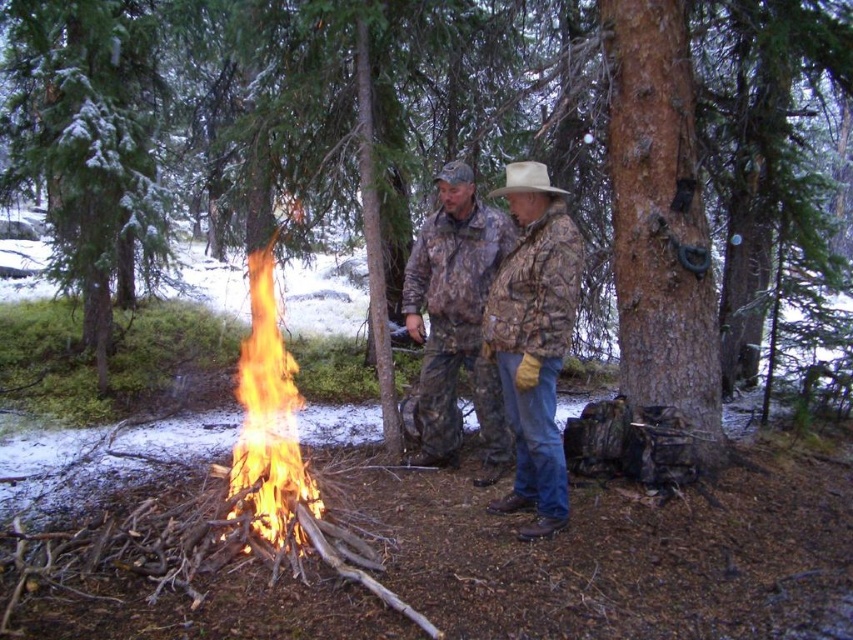
Is flameflame-likefire at left further to camera compared to white matte cowboy hat at center?

Yes, flameflame-likefire at left is behind white matte cowboy hat at center.

Does flameflame-likefire at left have a greater width compared to white matte cowboy hat at center?

In fact, flameflame-likefire at left might be narrower than white matte cowboy hat at center.

Between point (297, 547) and point (521, 192), which one is positioned behind?

The point (521, 192) is more distant.

Locate an element on the screen. This screenshot has height=640, width=853. flameflame-likefire at left is located at coordinates (268, 419).

The image size is (853, 640). What do you see at coordinates (357, 129) in the screenshot?
I see `brown rough tree at center` at bounding box center [357, 129].

Can you confirm if brown rough tree at center is shorter than white matte cowboy hat at center?

In fact, brown rough tree at center may be taller than white matte cowboy hat at center.

Does point (125, 13) come closer to viewer compared to point (531, 184)?

No, it is behind (531, 184).

This screenshot has width=853, height=640. Identify the location of brown rough tree at center. (357, 129).

Which is in front, point (3, 108) or point (247, 368)?

Point (247, 368) is in front.

Who is shorter, brown rough tree at center or flameflame-likefire at left?

With less height is flameflame-likefire at left.

Describe the element at coordinates (357, 129) in the screenshot. I see `brown rough tree at center` at that location.

At what (x,y) coordinates should I click in order to perform the action: click on brown rough tree at center. Please return your answer as a coordinate pair (x, y). Looking at the image, I should click on (357, 129).